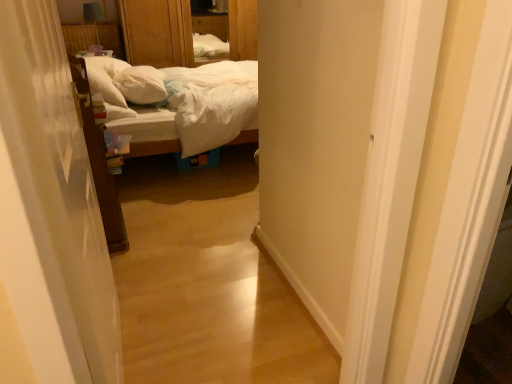
Question: Considering the relative sizes of white sheer curtain at left and wooden dresser at upper center in the image provided, is white sheer curtain at left smaller than wooden dresser at upper center?

Choices:
 (A) yes
 (B) no

Answer: (A)

Question: Are white sheer curtain at left and wooden dresser at upper center beside each other?

Choices:
 (A) no
 (B) yes

Answer: (A)

Question: Is wooden dresser at upper center completely or partially inside white sheer curtain at left?

Choices:
 (A) no
 (B) yes

Answer: (A)

Question: From a real-world perspective, is white sheer curtain at left positioned over wooden dresser at upper center based on gravity?

Choices:
 (A) yes
 (B) no

Answer: (B)

Question: Could you tell me if white sheer curtain at left is turned towards wooden dresser at upper center?

Choices:
 (A) yes
 (B) no

Answer: (B)

Question: Considering the relative positions of white soft pillow at center and white sheer curtain at left in the image provided, is white soft pillow at center to the left or to the right of white sheer curtain at left?

Choices:
 (A) left
 (B) right

Answer: (A)

Question: Is white soft pillow at center bigger or smaller than white sheer curtain at left?

Choices:
 (A) big
 (B) small

Answer: (B)

Question: In terms of height, does white soft pillow at center look taller or shorter compared to white sheer curtain at left?

Choices:
 (A) short
 (B) tall

Answer: (A)

Question: From a real-world perspective, is white soft pillow at center physically located above or below white sheer curtain at left?

Choices:
 (A) below
 (B) above

Answer: (A)

Question: From a real-world perspective, relative to white soft pillow at center, is wooden dresser at upper center vertically above or below?

Choices:
 (A) above
 (B) below

Answer: (A)

Question: Is wooden dresser at upper center wider or thinner than white soft pillow at center?

Choices:
 (A) wide
 (B) thin

Answer: (A)

Question: From the image's perspective, is wooden dresser at upper center located above or below white soft pillow at center?

Choices:
 (A) below
 (B) above

Answer: (B)

Question: Choose the correct answer: Is wooden dresser at upper center inside white soft pillow at center or outside it?

Choices:
 (A) inside
 (B) outside

Answer: (B)

Question: In terms of size, does white soft bed at center appear bigger or smaller than wooden dresser at upper center?

Choices:
 (A) small
 (B) big

Answer: (B)

Question: In terms of height, does white soft bed at center look taller or shorter compared to wooden dresser at upper center?

Choices:
 (A) short
 (B) tall

Answer: (A)